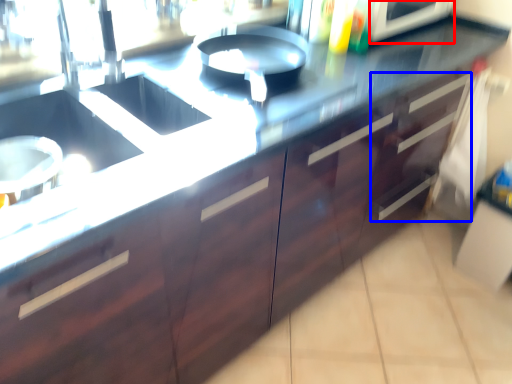
Question: Which object is closer to the camera taking this photo, appliance (highlighted by a red box) or drawer (highlighted by a blue box)?

Choices:
 (A) appliance
 (B) drawer

Answer: (A)